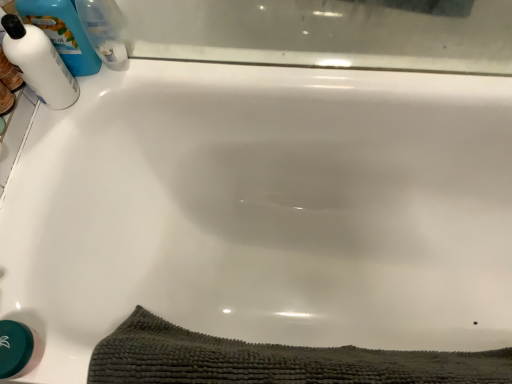
Find the location of `vacant space in front of blue plastic bottle at upper left, which is counted as the first cleaning product, starting from the right`. vacant space in front of blue plastic bottle at upper left, which is counted as the first cleaning product, starting from the right is located at coordinates (86, 97).